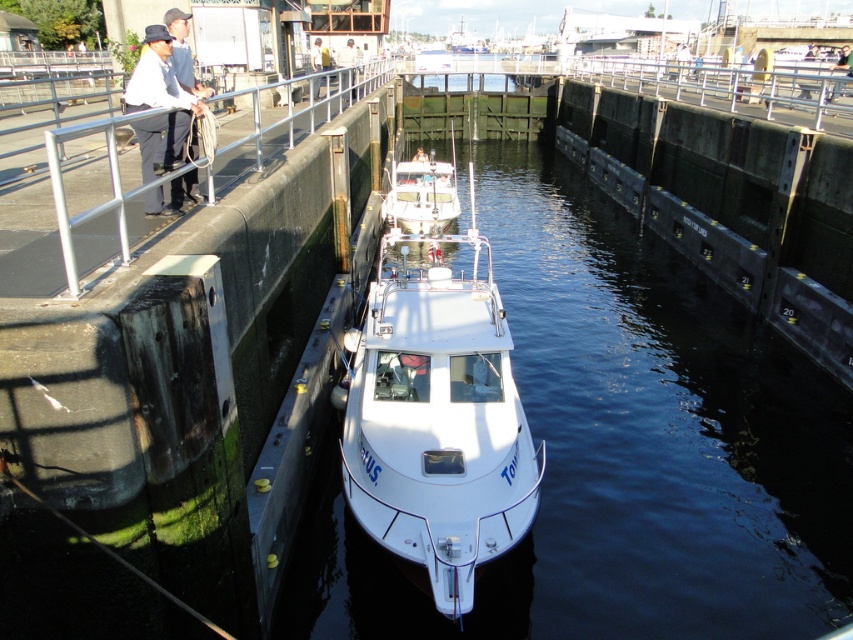
Question: Among these points, which one is farthest from the camera?

Choices:
 (A) (573, 372)
 (B) (186, 148)

Answer: (A)

Question: Is white glossy water at center to the left of white glossy boat at center from the viewer's perspective?

Choices:
 (A) no
 (B) yes

Answer: (A)

Question: Is white glossy water at center behind matte black hat at upper left?

Choices:
 (A) no
 (B) yes

Answer: (B)

Question: Can you confirm if white glossy water at center is thinner than white cotton shirt at upper left?

Choices:
 (A) yes
 (B) no

Answer: (B)

Question: Among these points, which one is farthest from the camera?

Choices:
 (A) (624, 609)
 (B) (190, 116)
 (C) (457, 333)
 (D) (173, 56)

Answer: (C)

Question: Which point is closer to the camera?

Choices:
 (A) white cotton shirt at upper left
 (B) white glossy boat at center

Answer: (B)